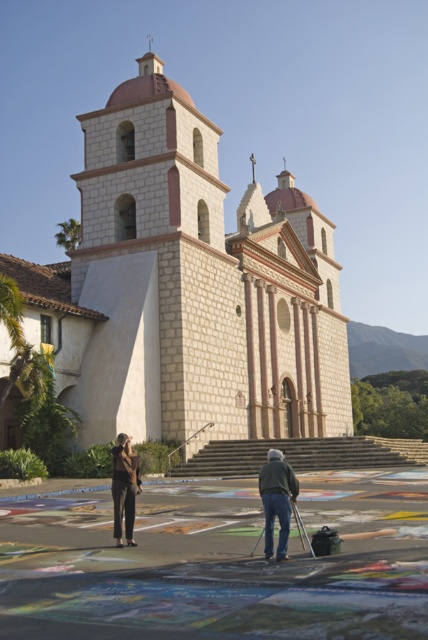
You are a photographer planning to take a wide shot of the white stone church at center and the dark gray jeans at center. Based on their sizes, which object should you focus on first to ensure both are in frame?

The white stone church at center is wider than the dark gray jeans at center, so you should focus on the white stone church at center first to ensure both fit within the frame.

You are standing in front of the historic stone church. You see the white stone church at center and the denim jacket at lower center. Which object is positioned higher in the image?

The white stone church at center is positioned higher than the denim jacket at lower center.

You are an art student who wants to draw the white stone church at center and the denim jacket at lower center. Which object should you draw first if you want to start with the one closer to you?

The denim jacket at lower center is closer to you than the white stone church at center, so you should draw the denim jacket at lower center first.